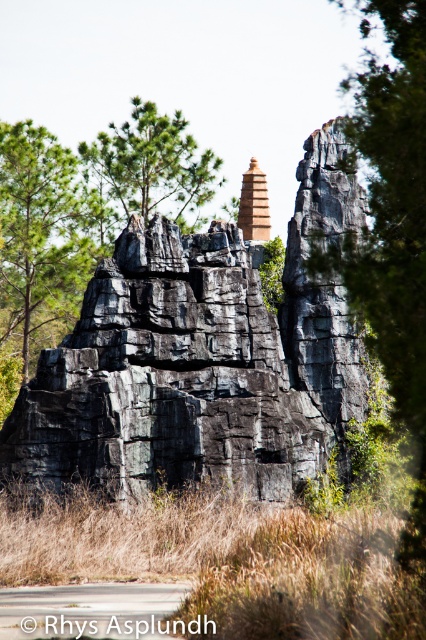
I want to click on green matte tree at upper left, so click(x=43, y=237).

Is point (29, 269) farther from camera compared to point (247, 232)?

No.

I want to click on green matte tree at upper left, so click(43, 237).

Can you confirm if black rough rock formation at center is taller than green matte tree at upper left?

Indeed, black rough rock formation at center has a greater height compared to green matte tree at upper left.

Is black rough rock formation at center above green matte tree at upper left?

No.

Is point (103, 422) positioned in front of point (3, 198)?

Yes, point (103, 422) is closer to viewer.

At what (x,y) coordinates should I click in order to perform the action: click on black rough rock formation at center. Please return your answer as a coordinate pair (x, y). Looking at the image, I should click on (201, 356).

Does green matte tree at upper left lie behind green matte tree at upper center?

No, it is in front of green matte tree at upper center.

Who is more forward, (91, 250) or (181, 193)?

Point (91, 250)

The width and height of the screenshot is (426, 640). Identify the location of green matte tree at upper left. (43, 237).

Identify the location of green matte tree at upper left. (43, 237).